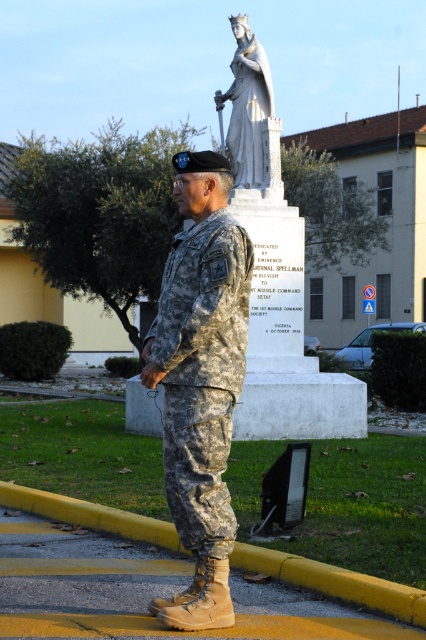
Question: Is camouflage uniform at center behind white marble statue at upper center?

Choices:
 (A) yes
 (B) no

Answer: (B)

Question: From the image, what is the correct spatial relationship of camouflage uniform at center in relation to white marble statue at upper center?

Choices:
 (A) left
 (B) right

Answer: (A)

Question: Among these objects, which one is farthest from the camera?

Choices:
 (A) white marble statue at upper center
 (B) camouflage uniform at center

Answer: (A)

Question: Which point is closer to the camera?

Choices:
 (A) (195, 508)
 (B) (258, 138)

Answer: (A)

Question: Considering the relative positions of camouflage uniform at center and white marble statue at upper center in the image provided, where is camouflage uniform at center located with respect to white marble statue at upper center?

Choices:
 (A) above
 (B) below

Answer: (B)